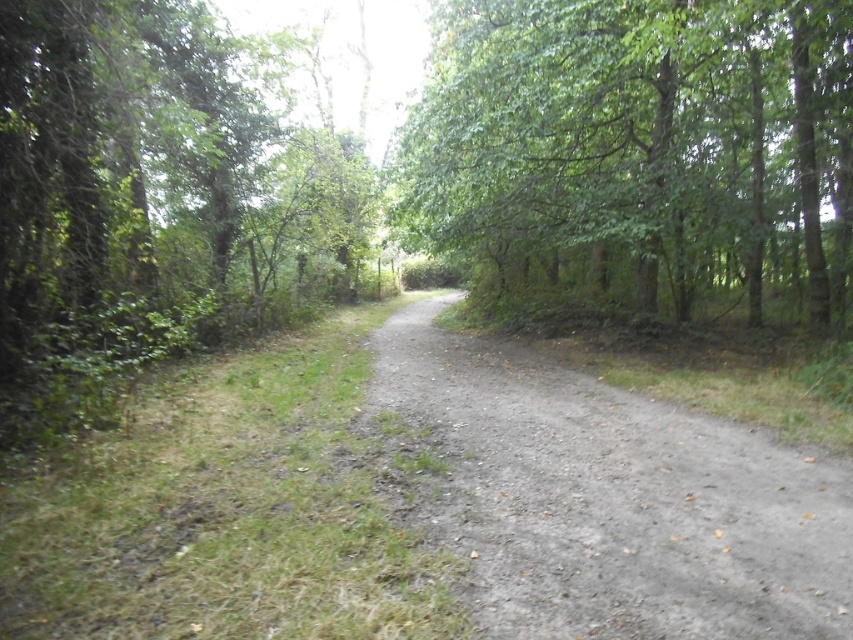
You are a hiker standing at the center of the forest path. You notice two trees ahead of you, the green leafy tree at upper right and the green leafy tree at left. Which tree has a wider trunk?

The green leafy tree at upper right has a wider trunk since its width is larger than the green leafy tree at left.